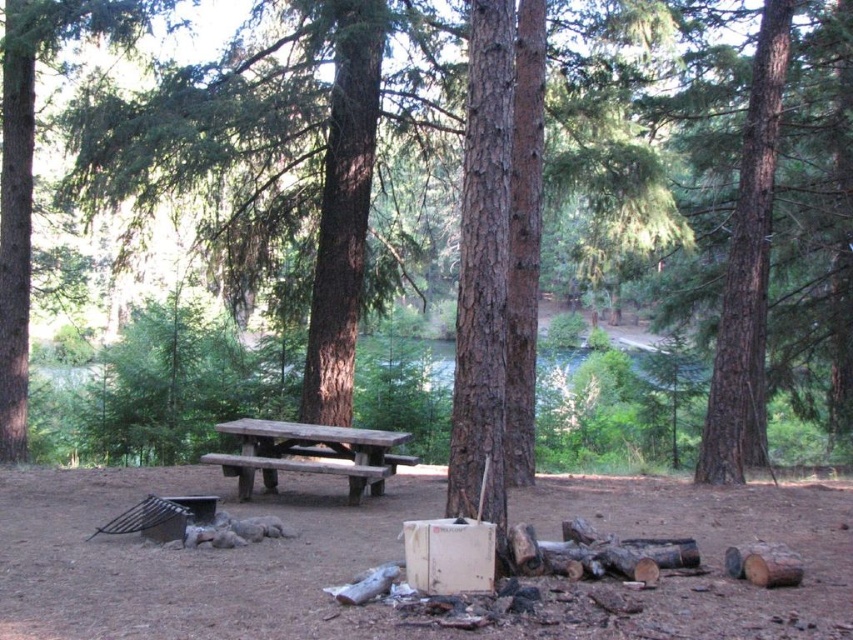
Question: Does green rough bark tree at left have a greater width compared to wooden picnic table at center?

Choices:
 (A) yes
 (B) no

Answer: (A)

Question: Which object is closer to the camera taking this photo?

Choices:
 (A) wooden picnic table at center
 (B) green rough bark tree at left

Answer: (A)

Question: Is green rough bark tree at left to the right of wooden picnic table at center from the viewer's perspective?

Choices:
 (A) no
 (B) yes

Answer: (A)

Question: From the image, what is the correct spatial relationship of green rough bark tree at left in relation to wooden picnic table at center?

Choices:
 (A) left
 (B) right

Answer: (A)

Question: Which point appears farthest from the camera in this image?

Choices:
 (A) (228, 454)
 (B) (22, 445)

Answer: (A)

Question: Which point is closer to the camera taking this photo?

Choices:
 (A) (53, 33)
 (B) (268, 490)

Answer: (B)